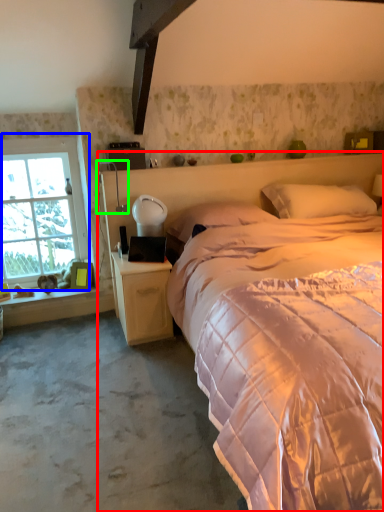
Question: Based on their relative distances, which object is farther from bed (highlighted by a red box)? Choose from window (highlighted by a blue box) and table lamp (highlighted by a green box).

Choices:
 (A) window
 (B) table lamp

Answer: (A)